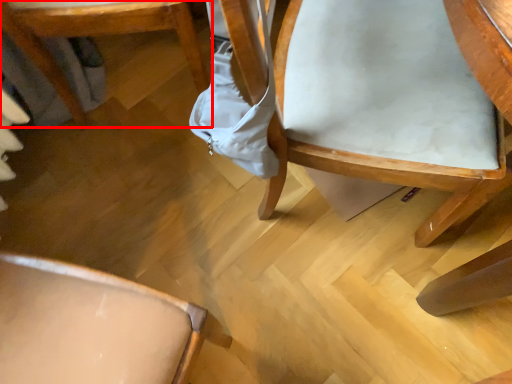
Question: Considering the relative positions of chair (annotated by the red box) and chair in the image provided, where is chair (annotated by the red box) located with respect to the staircase?

Choices:
 (A) right
 (B) left

Answer: (B)